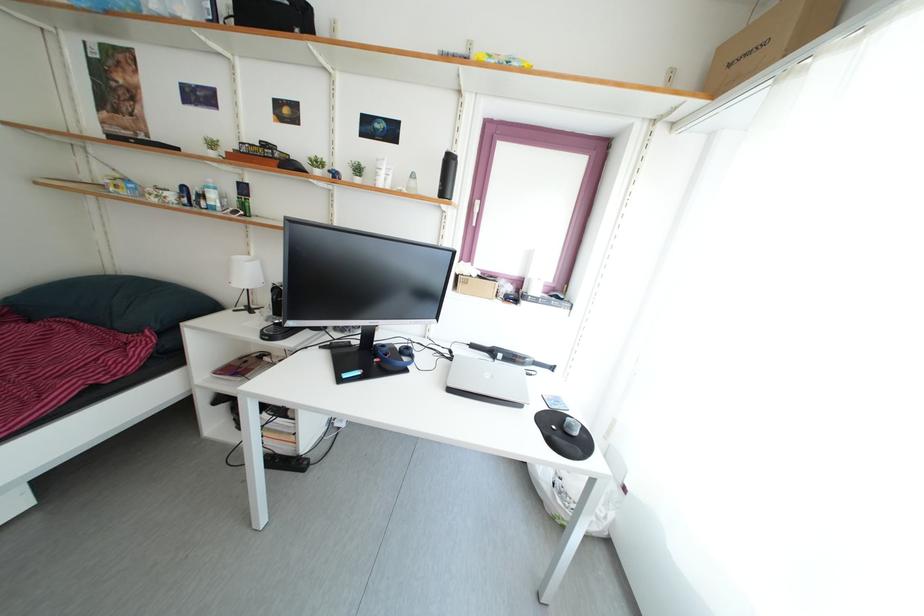
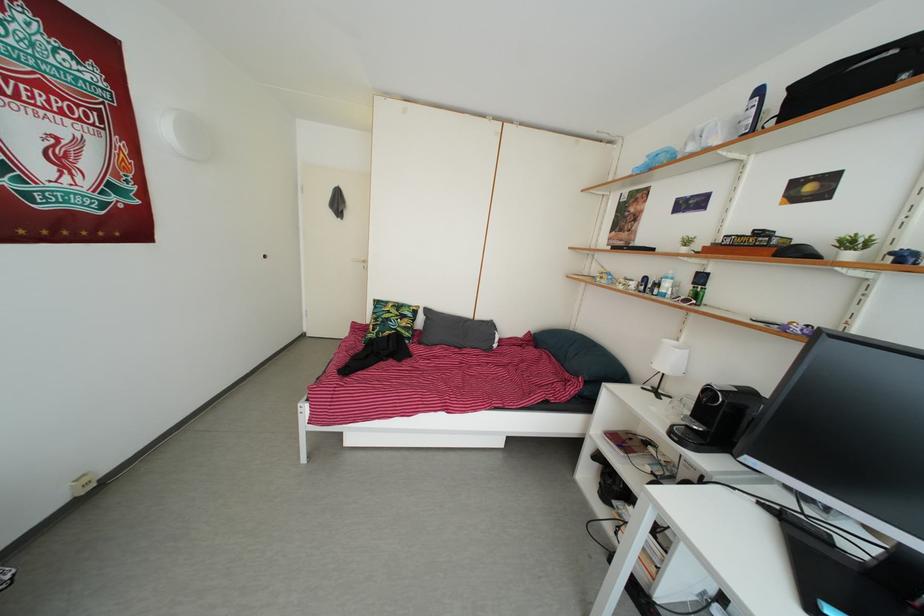
Locate, in the second image, the point that corresponds to (x=164, y=205) in the first image.

(630, 293)